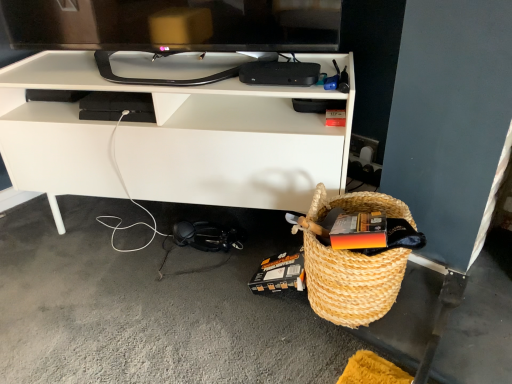
Question: Can you confirm if natural woven picnic basket at lower right is positioned to the left of black glossy tv at upper center?

Choices:
 (A) yes
 (B) no

Answer: (B)

Question: Does natural woven picnic basket at lower right have a larger size compared to black glossy tv at upper center?

Choices:
 (A) no
 (B) yes

Answer: (A)

Question: From the image's perspective, is natural woven picnic basket at lower right located beneath black glossy tv at upper center?

Choices:
 (A) yes
 (B) no

Answer: (A)

Question: Is natural woven picnic basket at lower right directly adjacent to black glossy tv at upper center?

Choices:
 (A) yes
 (B) no

Answer: (B)

Question: Is the depth of natural woven picnic basket at lower right greater than that of black glossy tv at upper center?

Choices:
 (A) yes
 (B) no

Answer: (B)

Question: Is natural woven picnic basket at lower right positioned far away from black glossy tv at upper center?

Choices:
 (A) yes
 (B) no

Answer: (B)

Question: Is white matte desk at center wider than black glossy tv at upper center?

Choices:
 (A) yes
 (B) no

Answer: (A)

Question: From a real-world perspective, is white matte desk at center physically above black glossy tv at upper center?

Choices:
 (A) no
 (B) yes

Answer: (A)

Question: Is white matte desk at center positioned beyond the bounds of black glossy tv at upper center?

Choices:
 (A) yes
 (B) no

Answer: (A)

Question: From the image's perspective, would you say white matte desk at center is shown under black glossy tv at upper center?

Choices:
 (A) yes
 (B) no

Answer: (A)

Question: Does white matte desk at center have a larger size compared to black glossy tv at upper center?

Choices:
 (A) yes
 (B) no

Answer: (A)

Question: Can you confirm if white matte desk at center is positioned to the right of black glossy tv at upper center?

Choices:
 (A) yes
 (B) no

Answer: (A)

Question: From the image's perspective, is black glossy tv at upper center below natural woven picnic basket at lower right?

Choices:
 (A) yes
 (B) no

Answer: (B)